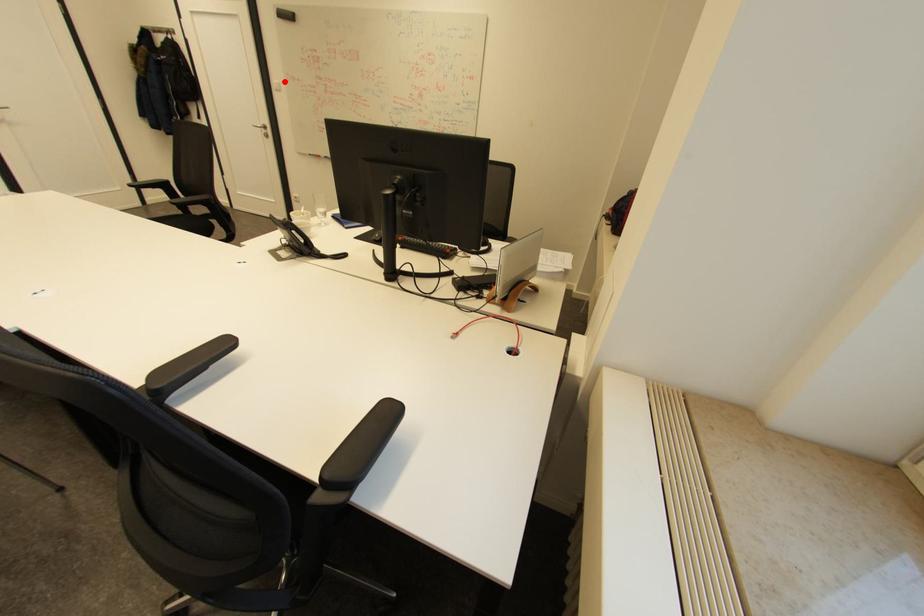
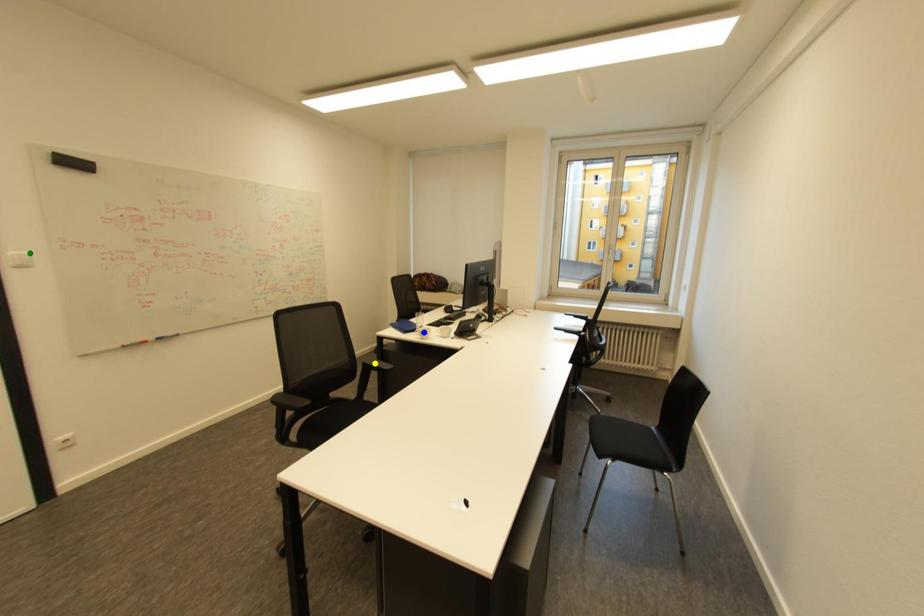
Question: I am providing you with two images of the same scene from different viewpoints. A red point is marked on the first image. You are given multiple points on the second image. Which spot in image 2 lines up with the point in image 1?

Choices:
 (A) green point
 (B) yellow point
 (C) blue point

Answer: (A)